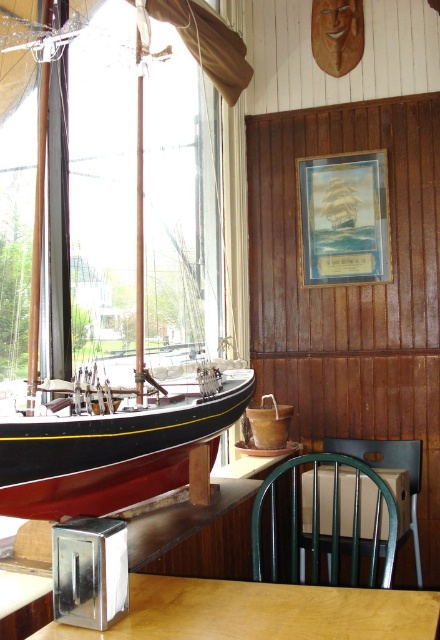
Question: Is black polished wood boat at left further to camera compared to wooden table at center?

Choices:
 (A) yes
 (B) no

Answer: (A)

Question: Is wooden table at center below green wooden chair at lower center?

Choices:
 (A) yes
 (B) no

Answer: (B)

Question: Among these points, which one is nearest to the camera?

Choices:
 (A) (341, 545)
 (B) (234, 52)
 (C) (220, 620)

Answer: (C)

Question: Estimate the real-world distances between objects in this image. Which object is closer to the green wooden chair at lower center?

Choices:
 (A) black polished wood boat at left
 (B) wooden table at center

Answer: (B)

Question: Is black polished wood boat at left wider than wooden table at center?

Choices:
 (A) yes
 (B) no

Answer: (B)

Question: Based on their relative distances, which object is nearer to the black polished wood boat at left?

Choices:
 (A) wooden table at center
 (B) green wooden chair at lower center

Answer: (B)